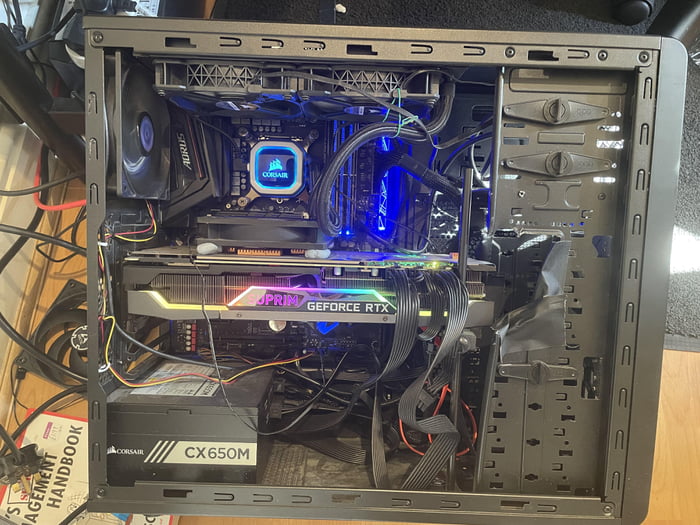
Where is `black fan`? The image size is (700, 525). black fan is located at coordinates (64, 319).